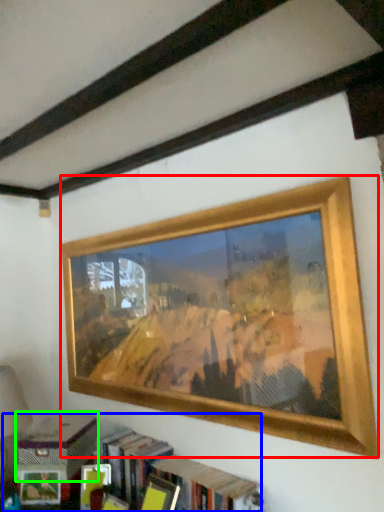
Question: Which object is positioned closest to picture frame (highlighted by a red box)? Select from bookcase (highlighted by a blue box) and paperback book (highlighted by a green box).

Choices:
 (A) bookcase
 (B) paperback book

Answer: (A)